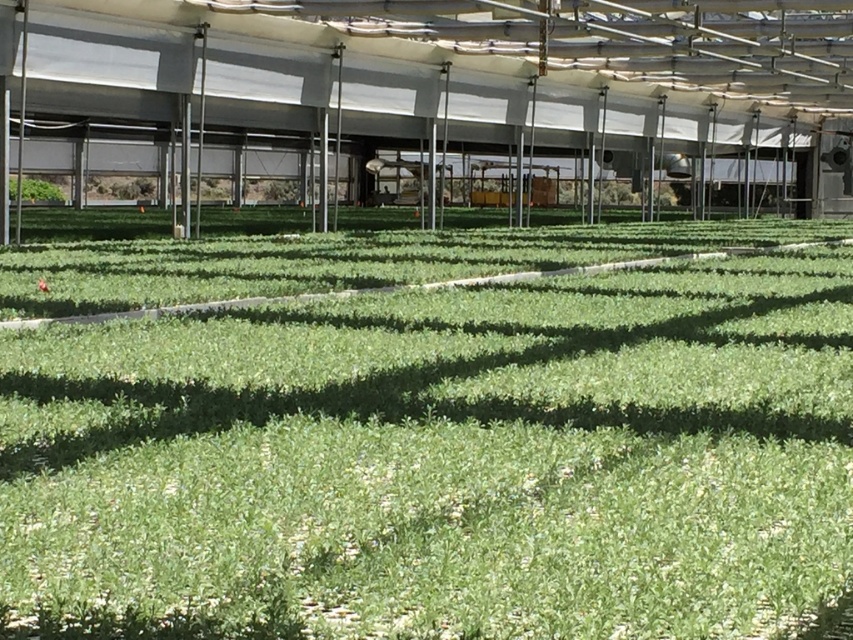
Is green leafy grass at center closer to camera compared to green leafy plant at left?

That is True.

Is green leafy grass at center bigger than green leafy plant at left?

Incorrect, green leafy grass at center is not larger than green leafy plant at left.

Does point (720, 248) come in front of point (41, 188)?

Yes, point (720, 248) is in front of point (41, 188).

Find the location of `green leafy grass at center`. green leafy grass at center is located at coordinates (x=442, y=461).